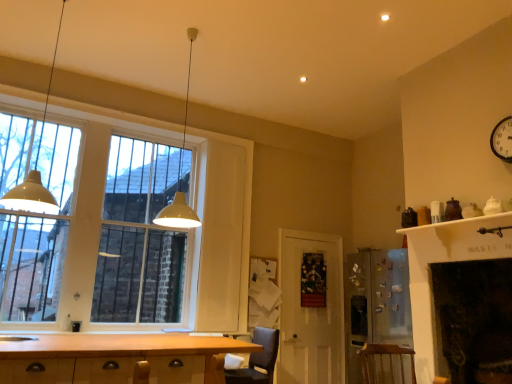
Describe the element at coordinates (310, 312) in the screenshot. This screenshot has width=512, height=384. I see `white wooden door at center` at that location.

Identify the location of white wooden door at center. The width and height of the screenshot is (512, 384). (310, 312).

Describe the element at coordinates (17, 338) in the screenshot. Image resolution: width=512 pixels, height=384 pixels. I see `white glossy sink at lower left` at that location.

The height and width of the screenshot is (384, 512). What are the coordinates of `matte white pendant lamp at left, the 2th light fixture in the right-to-left sequence` in the screenshot? It's located at (35, 170).

The image size is (512, 384). What do you see at coordinates (180, 174) in the screenshot?
I see `matte yellow pendant light at upper center, positioned as the 2th light fixture in left-to-right order` at bounding box center [180, 174].

Identify the location of matte yellow pendant light at upper center, the 1th light fixture viewed from the right. (180, 174).

Locate an element on the screen. white glossy clock at upper right is located at coordinates 502,139.

Is white glossy sink at lower left to the right of matte white pendant lamp at left, the 2th light fixture in the right-to-left sequence, from the viewer's perspective?

No, white glossy sink at lower left is not to the right of matte white pendant lamp at left, the 2th light fixture in the right-to-left sequence.

Between white glossy sink at lower left and matte white pendant lamp at left, the 2th light fixture in the right-to-left sequence, which one has more height?

With more height is matte white pendant lamp at left, the 2th light fixture in the right-to-left sequence.

From a real-world perspective, is white glossy sink at lower left under matte white pendant lamp at left, the 2th light fixture in the right-to-left sequence?

Yes, from a real-world perspective, white glossy sink at lower left is below matte white pendant lamp at left, the 2th light fixture in the right-to-left sequence.

Is point (24, 336) in front of point (17, 208)?

No, (24, 336) is behind (17, 208).

How distant is dark gray fabric armchair at lower center, placed as the 1th armchair when sorted from left to right, from wooden cabinet at lower left?

The distance of dark gray fabric armchair at lower center, placed as the 1th armchair when sorted from left to right, from wooden cabinet at lower left is 24.77 inches.

Looking at this image, considering the relative sizes of dark gray fabric armchair at lower center, the second armchair when ordered from right to left, and wooden cabinet at lower left in the image provided, is dark gray fabric armchair at lower center, the second armchair when ordered from right to left, thinner than wooden cabinet at lower left?

Yes.

From the image's perspective, is dark gray fabric armchair at lower center, the second armchair when ordered from right to left, located above wooden cabinet at lower left?

Yes, from the image's perspective, dark gray fabric armchair at lower center, the second armchair when ordered from right to left, is over wooden cabinet at lower left.

Considering the positions of objects dark gray fabric armchair at lower center, the second armchair when ordered from right to left, and wooden cabinet at lower left in the image provided, who is more to the right, dark gray fabric armchair at lower center, the second armchair when ordered from right to left, or wooden cabinet at lower left?

From the viewer's perspective, dark gray fabric armchair at lower center, the second armchair when ordered from right to left, appears more on the right side.

Can you tell me how much matte white pendant lamp at left, which is counted as the 1th light fixture, starting from the left, and white glossy sink at lower left differ in facing direction?

matte white pendant lamp at left, which is counted as the 1th light fixture, starting from the left, and white glossy sink at lower left are facing 92.5 degrees away from each other.

From the picture: Which is behind, matte white pendant lamp at left, which is counted as the 1th light fixture, starting from the left, or white glossy sink at lower left?

matte white pendant lamp at left, which is counted as the 1th light fixture, starting from the left, is further away from the camera.

Is white glossy sink at lower left inside matte white pendant lamp at left, which is counted as the 1th light fixture, starting from the left?

No, white glossy sink at lower left is not surrounded by matte white pendant lamp at left, which is counted as the 1th light fixture, starting from the left.

From the image's perspective, which is below, matte white pendant lamp at left, the 2th light fixture in the right-to-left sequence, or white glossy sink at lower left?

white glossy sink at lower left is shown below in the image.

Which object is closer to the camera, matte glass window at left or matte white pendant lamp at left, the 2th light fixture in the right-to-left sequence?

matte white pendant lamp at left, the 2th light fixture in the right-to-left sequence, is more forward.

Considering the relative positions of matte glass window at left and matte white pendant lamp at left, which is counted as the 1th light fixture, starting from the left, in the image provided, is matte glass window at left to the left or to the right of matte white pendant lamp at left, which is counted as the 1th light fixture, starting from the left,?

matte glass window at left is to the right of matte white pendant lamp at left, which is counted as the 1th light fixture, starting from the left.

Can you tell me how much matte glass window at left and matte white pendant lamp at left, which is counted as the 1th light fixture, starting from the left, differ in facing direction?

matte glass window at left and matte white pendant lamp at left, which is counted as the 1th light fixture, starting from the left, are facing 87.5 degrees away from each other.

Is matte glass window at left positioned far away from matte white pendant lamp at left, the 2th light fixture in the right-to-left sequence?

Yes, matte glass window at left and matte white pendant lamp at left, the 2th light fixture in the right-to-left sequence, are located far from each other.

Could you tell me if matte white pendant lamp at left, which is counted as the 1th light fixture, starting from the left, is facing wooden at lower right, arranged as the first armchair when viewed from the right?

Yes, matte white pendant lamp at left, which is counted as the 1th light fixture, starting from the left, is turned towards wooden at lower right, arranged as the first armchair when viewed from the right.

From the image's perspective, who appears lower, matte white pendant lamp at left, the 2th light fixture in the right-to-left sequence, or wooden at lower right, the second armchair viewed from the left?

wooden at lower right, the second armchair viewed from the left, appears lower in the image.

Which of these two, matte white pendant lamp at left, the 2th light fixture in the right-to-left sequence, or wooden at lower right, arranged as the first armchair when viewed from the right, is wider?

wooden at lower right, arranged as the first armchair when viewed from the right.

At what (x,y) coordinates should I click in order to perform the action: click on cabinetry on the left of the white glossy clock at upper right. Please return your answer as a coordinate pair (x, y). This screenshot has width=512, height=384. Looking at the image, I should click on (117, 358).

Between white glossy clock at upper right and wooden cabinet at lower left, which one has smaller size?

With smaller size is white glossy clock at upper right.

Which is less distant, (511, 117) or (54, 347)?

Clearly, point (511, 117) is more distant from the camera than point (54, 347).

From the image's perspective, between white glossy clock at upper right and wooden cabinet at lower left, which one is located above?

white glossy clock at upper right, from the image's perspective.

Is wooden at lower right, the second armchair viewed from the left, shorter than matte white pendant lamp at left, which is counted as the 1th light fixture, starting from the left?

Yes.

I want to click on light fixture that is the 1st object above the wooden at lower right, the second armchair viewed from the left (from a real-world perspective), so click(35, 170).

Could you tell me if wooden at lower right, arranged as the first armchair when viewed from the right, is facing matte white pendant lamp at left, the 2th light fixture in the right-to-left sequence?

No, wooden at lower right, arranged as the first armchair when viewed from the right, does not turn towards matte white pendant lamp at left, the 2th light fixture in the right-to-left sequence.

Between wooden at lower right, the second armchair viewed from the left, and matte white pendant lamp at left, which is counted as the 1th light fixture, starting from the left, which one is positioned in front?

matte white pendant lamp at left, which is counted as the 1th light fixture, starting from the left.

Find the location of `sink located below the matte white pendant lamp at left, the 2th light fixture in the right-to-left sequence (from the image's perspective)`. sink located below the matte white pendant lamp at left, the 2th light fixture in the right-to-left sequence (from the image's perspective) is located at coordinates (17, 338).

Identify the location of cabinetry in front of the dark gray fabric armchair at lower center, the second armchair when ordered from right to left. The height and width of the screenshot is (384, 512). click(x=117, y=358).

Considering their positions, is white wooden door at center positioned closer to wooden at lower right, the second armchair viewed from the left, than dark gray fabric armchair at lower center, the second armchair when ordered from right to left?

dark gray fabric armchair at lower center, the second armchair when ordered from right to left.

Estimate the real-world distances between objects in this image. Which object is closer to matte glass window at left, matte white pendant lamp at left, which is counted as the 1th light fixture, starting from the left, or matte yellow pendant light at upper center, positioned as the 2th light fixture in left-to-right order?

matte yellow pendant light at upper center, positioned as the 2th light fixture in left-to-right order, is positioned closer to the anchor matte glass window at left.

From the image, which object appears to be farther from white glossy sink at lower left, wooden at lower right, arranged as the first armchair when viewed from the right, or matte yellow pendant light at upper center, the 1th light fixture viewed from the right?

wooden at lower right, arranged as the first armchair when viewed from the right, is further to white glossy sink at lower left.

When comparing their distances from wooden at lower right, arranged as the first armchair when viewed from the right, does matte white pendant lamp at left, the 2th light fixture in the right-to-left sequence, or white wooden door at center seem further?

matte white pendant lamp at left, the 2th light fixture in the right-to-left sequence.

Consider the image. Considering their positions, is matte yellow pendant light at upper center, the 1th light fixture viewed from the right, positioned closer to white glossy sink at lower left than matte white pendant lamp at left, the 2th light fixture in the right-to-left sequence?

Among the two, matte white pendant lamp at left, the 2th light fixture in the right-to-left sequence, is located nearer to white glossy sink at lower left.

From the picture: Estimate the real-world distances between objects in this image. Which object is closer to matte yellow pendant light at upper center, positioned as the 2th light fixture in left-to-right order, white wooden door at center or white glossy sink at lower left?

white glossy sink at lower left.

Considering their positions, is matte white pendant lamp at left, which is counted as the 1th light fixture, starting from the left, positioned further to wooden cabinet at lower left than matte glass window at left?

matte glass window at left lies further to wooden cabinet at lower left than the other object.

When comparing their distances from white wooden door at center, does wooden at lower right, arranged as the first armchair when viewed from the right, or matte white pendant lamp at left, which is counted as the 1th light fixture, starting from the left, seem closer?

Based on the image, wooden at lower right, arranged as the first armchair when viewed from the right, appears to be nearer to white wooden door at center.

Where is `window between matte white pendant lamp at left, which is counted as the 1th light fixture, starting from the left, and white glossy clock at upper right from left to right`? window between matte white pendant lamp at left, which is counted as the 1th light fixture, starting from the left, and white glossy clock at upper right from left to right is located at coordinates (219, 233).

At what (x,y) coordinates should I click in order to perform the action: click on armchair between white glossy sink at lower left and wooden at lower right, arranged as the first armchair when viewed from the right, in the horizontal direction. Please return your answer as a coordinate pair (x, y). The image size is (512, 384). Looking at the image, I should click on (x=258, y=360).

This screenshot has height=384, width=512. Identify the location of window that lies between matte white pendant lamp at left, the 2th light fixture in the right-to-left sequence, and dark gray fabric armchair at lower center, placed as the 1th armchair when sorted from left to right, from top to bottom. (219, 233).

What are the coordinates of `armchair between dark gray fabric armchair at lower center, the second armchair when ordered from right to left, and white wooden door at center in the front-back direction` in the screenshot? It's located at (387, 364).